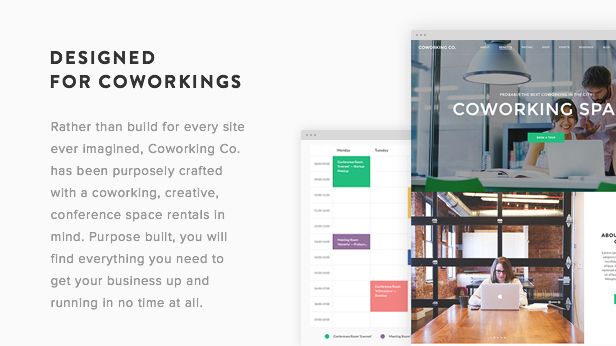
At what (x,y) coordinates should I click in order to perform the action: click on white walls. Please return your answer as a coordinate pair (x, y). The height and width of the screenshot is (346, 616). Looking at the image, I should click on (474, 124), (509, 118), (578, 80).